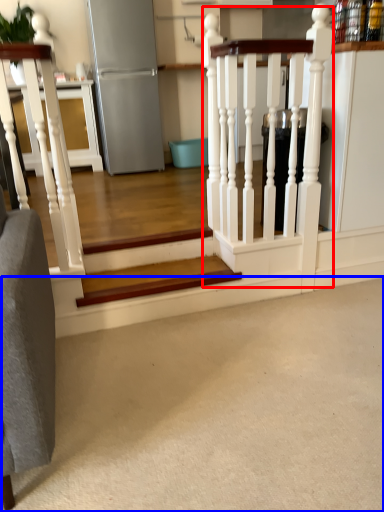
Question: Which of the following is the farthest to the observer, rail (highlighted by a red box) or concrete (highlighted by a blue box)?

Choices:
 (A) rail
 (B) concrete

Answer: (A)